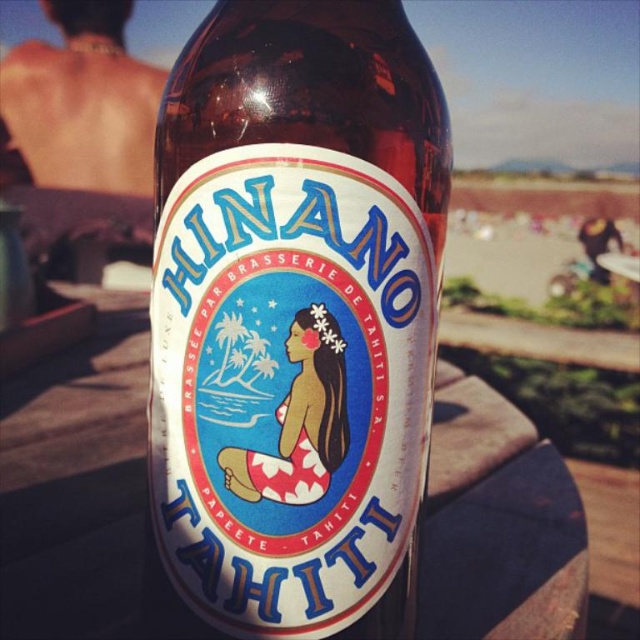
Question: Which point is closer to the camera?

Choices:
 (A) translucent glass bottle at center
 (B) skinny tan skin at upper left

Answer: (A)

Question: Which point appears closest to the camera in this image?

Choices:
 (A) pos(45,145)
 (B) pos(168,336)

Answer: (B)

Question: From the image, what is the correct spatial relationship of translucent glass bottle at center in relation to skinny tan skin at upper left?

Choices:
 (A) right
 (B) left

Answer: (A)

Question: Does translucent glass bottle at center appear under skinny tan skin at upper left?

Choices:
 (A) yes
 (B) no

Answer: (A)

Question: Does translucent glass bottle at center appear on the right side of skinny tan skin at upper left?

Choices:
 (A) yes
 (B) no

Answer: (A)

Question: Which point is closer to the camera?

Choices:
 (A) translucent glass bottle at center
 (B) skinny tan skin at upper left

Answer: (A)